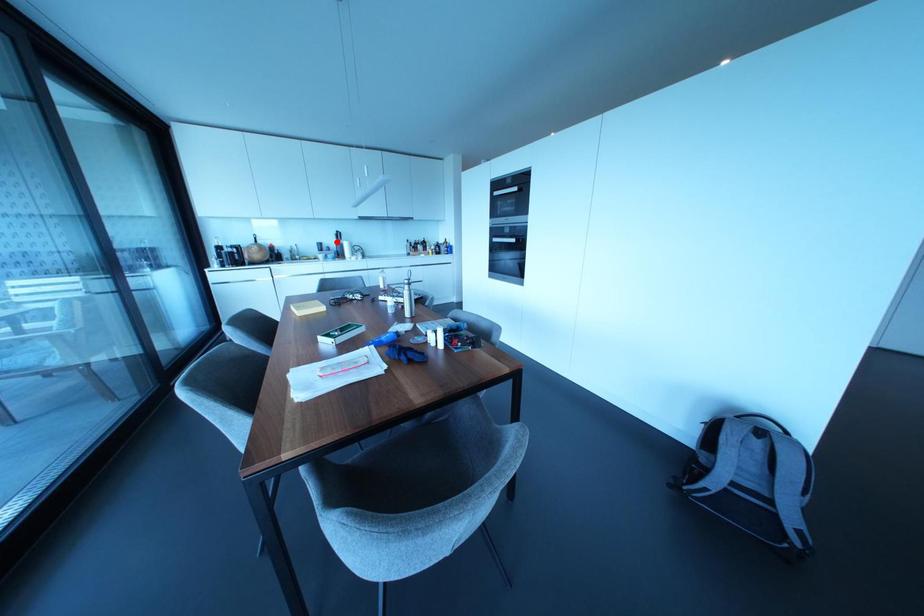
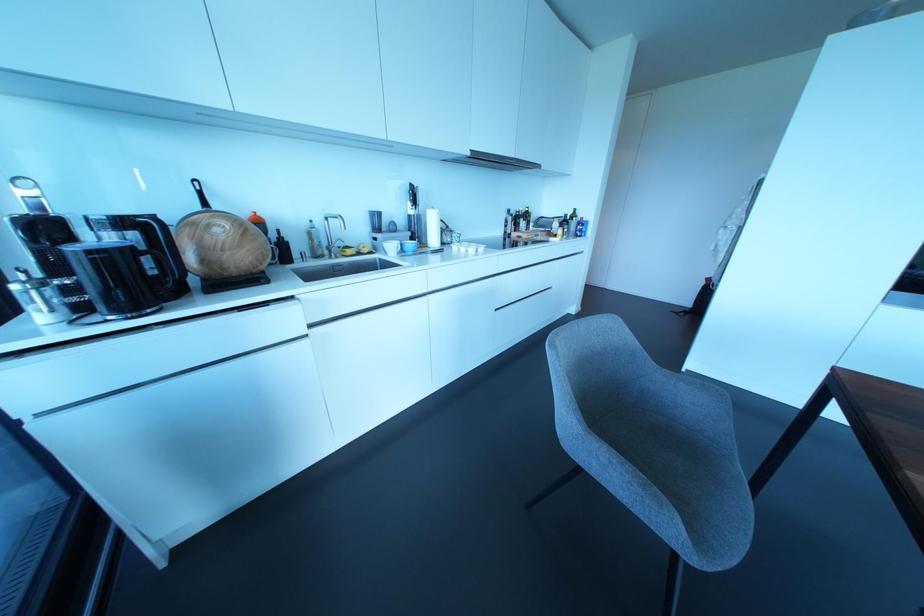
In the second image, find the point that corresponds to the highlighted location in the first image.

(410, 211)